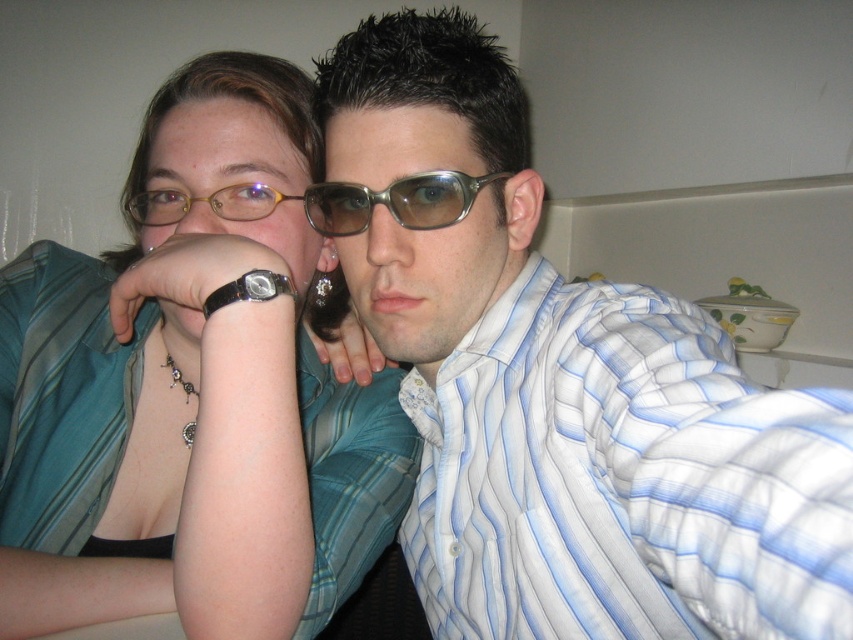
Question: Which point is closer to the camera?

Choices:
 (A) matte blue striped shirt at center
 (B) gold plastic glasses at upper center

Answer: (A)

Question: Is matte teal blouse at center to the right of gold plastic glasses at upper center from the viewer's perspective?

Choices:
 (A) no
 (B) yes

Answer: (A)

Question: Can you confirm if metallic frame glasses at center is positioned above gold plastic glasses at upper center?

Choices:
 (A) yes
 (B) no

Answer: (B)

Question: Can you confirm if matte blue striped shirt at center is wider than gold plastic glasses at upper center?

Choices:
 (A) no
 (B) yes

Answer: (B)

Question: Which point is farther to the camera?

Choices:
 (A) metallic frame glasses at center
 (B) gold plastic glasses at upper center

Answer: (B)

Question: Estimate the real-world distances between objects in this image. Which object is closer to the metallic frame glasses at center?

Choices:
 (A) matte teal blouse at center
 (B) matte blue striped shirt at center
 (C) gold plastic glasses at upper center

Answer: (C)